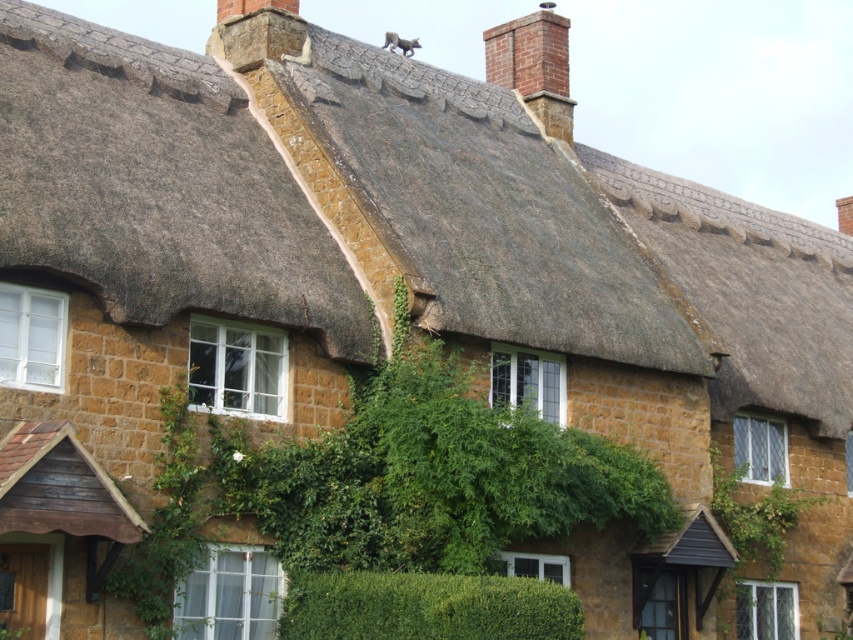
You are a painter standing in front of the house. You need to paint both the thatched straw roof at upper center and the green leafy hedge at center. Which object should you paint first if you want to start with the wider one?

You should paint the thatched straw roof at upper center first because its width is larger than the green leafy hedge at center.

You are standing in front of the traditional house and want to place a decorative pot exactly at the position of the brown thatch at center. What are the coordinates where you should place the pot?

The brown thatch at center is located at point (155,186), so you should place the decorative pot at those coordinates.

You are standing in front of the traditional house with a thatched roof. There is a point marked at coordinates [486,209]. Which part of the house does this point indicate?

The point at coordinates [486,209] corresponds to the thatched roof at upper center of the house.